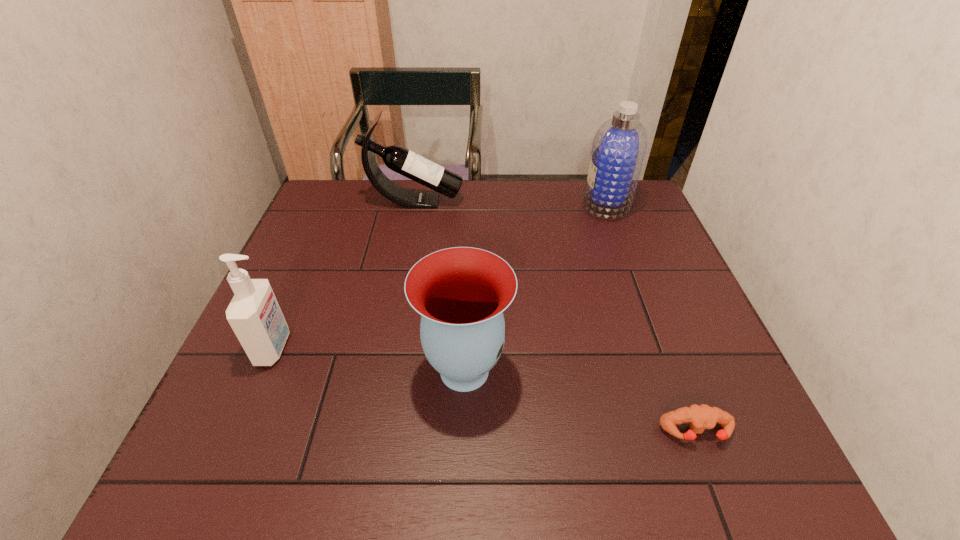
I want to click on free space located 0.050m on the front label of the left cleansing agent, so click(x=312, y=348).

Locate an element on the screen. vacant space located 0.120m on the front of the vase is located at coordinates (462, 475).

Locate an element on the screen. cleansing agent that is at the far edge is located at coordinates pyautogui.click(x=618, y=150).

This screenshot has width=960, height=540. In order to click on wine bottle at the far edge in this screenshot , I will do `click(397, 158)`.

What are the coordinates of `object that is at the near edge` in the screenshot? It's located at (700, 417).

Find the location of a particular element. The image size is (960, 540). object that is positioned at the left edge is located at coordinates (254, 314).

At what (x,y) coordinates should I click in order to perform the action: click on cleansing agent that is at the right edge. Please return your answer as a coordinate pair (x, y). Looking at the image, I should click on (618, 150).

Find the location of a particular element. The image size is (960, 540). puncher positioned at the right edge is located at coordinates (700, 417).

The width and height of the screenshot is (960, 540). I want to click on object that is at the far right corner, so [618, 150].

This screenshot has width=960, height=540. In order to click on object located in the near right corner section of the desktop in this screenshot , I will do `click(700, 417)`.